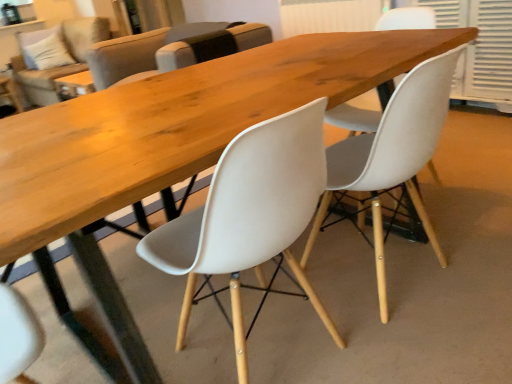
Question: From the image's perspective, relative to white textured shutter at upper right, is matte white chair at center, acting as the 3th chair starting from the back, above or below?

Choices:
 (A) below
 (B) above

Answer: (A)

Question: Considering their positions, is matte white chair at center, which is the first chair from front to back, located in front of or behind white textured shutter at upper right?

Choices:
 (A) behind
 (B) front

Answer: (B)

Question: Based on their relative distances, which object is nearer to the beige fabric couch at upper left?

Choices:
 (A) white plastic chair at center, the 2th chair viewed from the front
 (B) white textured shutter at upper right
 (C) matte white chair at center, acting as the 3th chair starting from the back
 (D) white plastic chair at center, acting as the first chair starting from the back

Answer: (D)

Question: Which of these objects is positioned farthest from the matte white chair at center, acting as the 3th chair starting from the back?

Choices:
 (A) white textured shutter at upper right
 (B) beige fabric couch at upper left
 (C) white plastic chair at center, which is the 3th chair from front to back
 (D) white plastic chair at center, the 2th chair viewed from the front

Answer: (B)